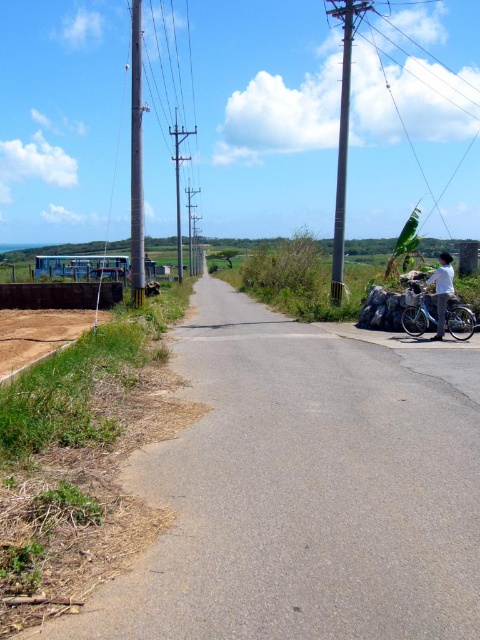
Question: Does silver metallic bicycle at right appear under white matte shirt at right?

Choices:
 (A) yes
 (B) no

Answer: (A)

Question: Among these objects, which one is farthest from the camera?

Choices:
 (A) silver metallic bicycle at right
 (B) smooth gray telegraph pole at center
 (C) metallic gray telegraph pole at center-right

Answer: (B)

Question: Which object is farther from the camera taking this photo?

Choices:
 (A) green plastic pole at upper right
 (B) metallic gray telegraph pole at center-right

Answer: (A)

Question: Is metallic gray telegraph pole at center-right wider than white matte shirt at right?

Choices:
 (A) no
 (B) yes

Answer: (B)

Question: Can you confirm if green plastic pole at upper right is thinner than metallic gray telegraph pole at center-right?

Choices:
 (A) no
 (B) yes

Answer: (A)

Question: Considering the real-world distances, which object is closest to the metallic gray telegraph pole at center-right?

Choices:
 (A) smooth gray pole at left
 (B) silver metallic bicycle at right
 (C) smooth gray telegraph pole at center
 (D) white matte shirt at right

Answer: (B)